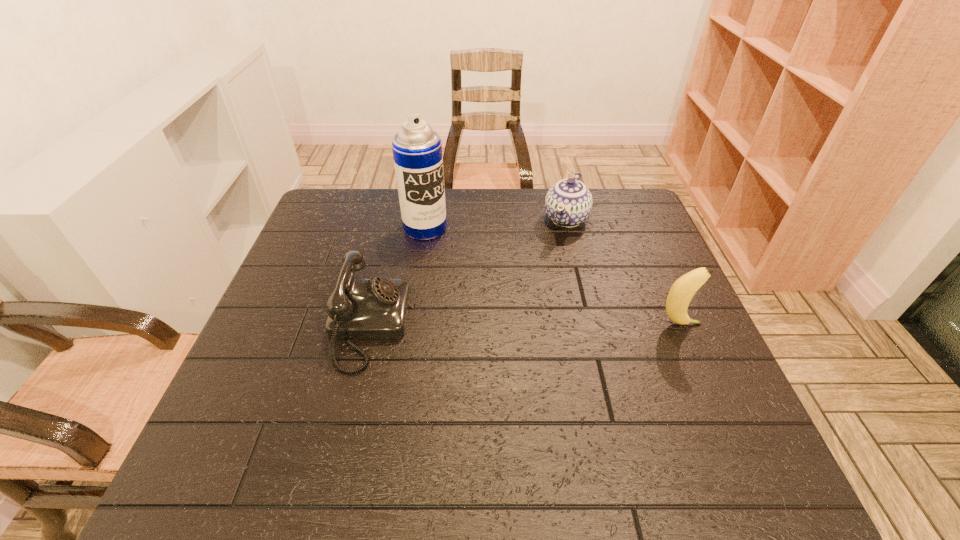
In the image, there is a desktop. Identify the location of vacant space at the far right corner. (623, 208).

Where is `free spot at the near right corner of the desktop`? This screenshot has width=960, height=540. free spot at the near right corner of the desktop is located at coordinates (709, 419).

Locate an element on the screen. free spot between the telephone and the banana is located at coordinates (524, 325).

At what (x,y) coordinates should I click in order to perform the action: click on empty location between the tallest object and the rightmost object. Please return your answer as a coordinate pair (x, y). Image resolution: width=960 pixels, height=540 pixels. Looking at the image, I should click on (552, 276).

Find the location of a particular element. The height and width of the screenshot is (540, 960). vacant area between the rightmost object and the chinaware is located at coordinates (623, 272).

The height and width of the screenshot is (540, 960). I want to click on unoccupied area between the rightmost object and the tallest object, so click(552, 276).

You are a GUI agent. You are given a task and a screenshot of the screen. Output one action in this format:
    pyautogui.click(x=<x>, y=<y>)
    Task: Click on the vacant area that lies between the tallest object and the telephone
    This screenshot has height=540, width=960.
    Given the screenshot: What is the action you would take?
    pyautogui.click(x=397, y=276)

Find the location of `empty location between the telephone and the rightmost object`. empty location between the telephone and the rightmost object is located at coordinates (524, 325).

Where is `empty space that is in between the tallest object and the telephone`? empty space that is in between the tallest object and the telephone is located at coordinates (397, 276).

The image size is (960, 540). Identify the location of vacant space that is in between the chinaware and the telephone. (468, 272).